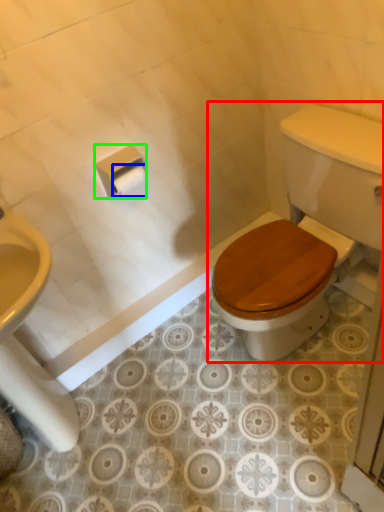
Question: Estimate the real-world distances between objects in this image. Which object is closer to toilet (highlighted by a red box), toilet paper (highlighted by a blue box) or toilet paper (highlighted by a green box)?

Choices:
 (A) toilet paper
 (B) toilet paper

Answer: (B)